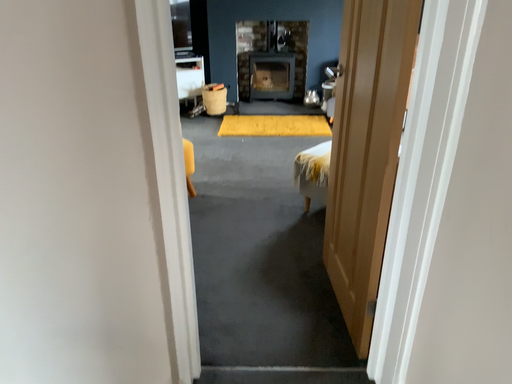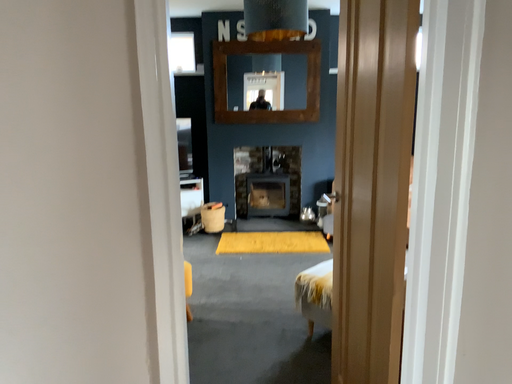
Question: How did the camera likely rotate when shooting the video?

Choices:
 (A) rotated upward
 (B) rotated downward

Answer: (A)